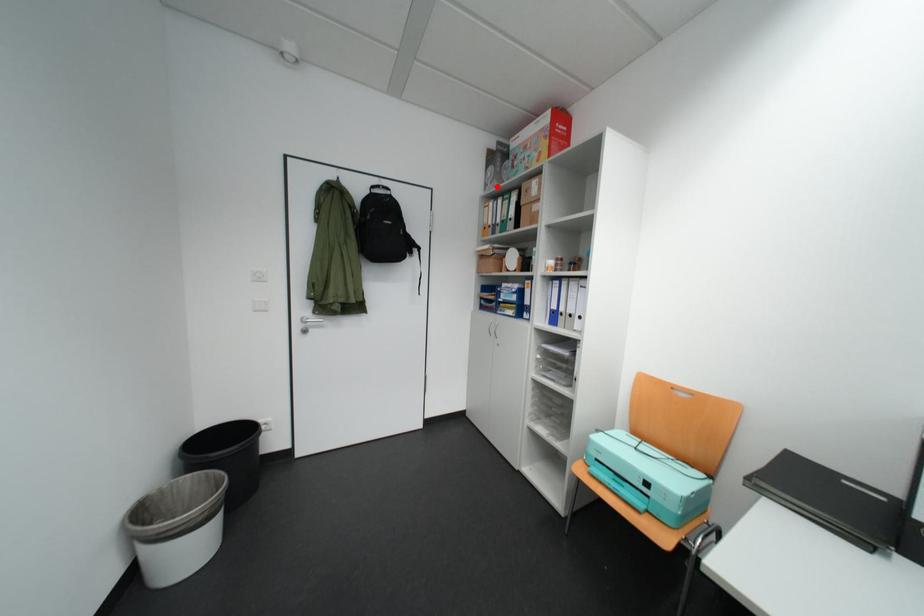
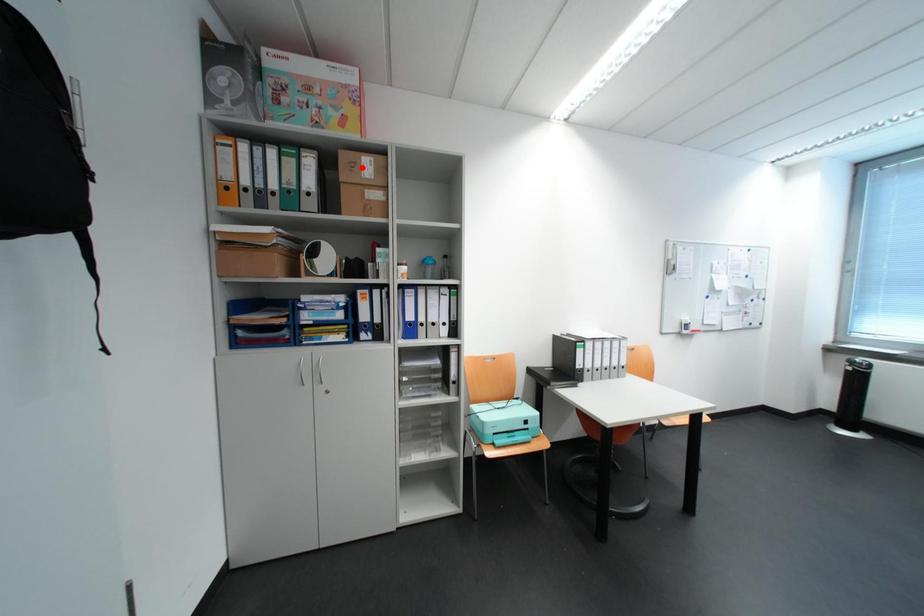
I am providing you with two images of the same scene from different viewpoints. A red point is marked on the first image and another point is marked on the second image. Is the red point in image1 aligned with the point shown in image2?

No